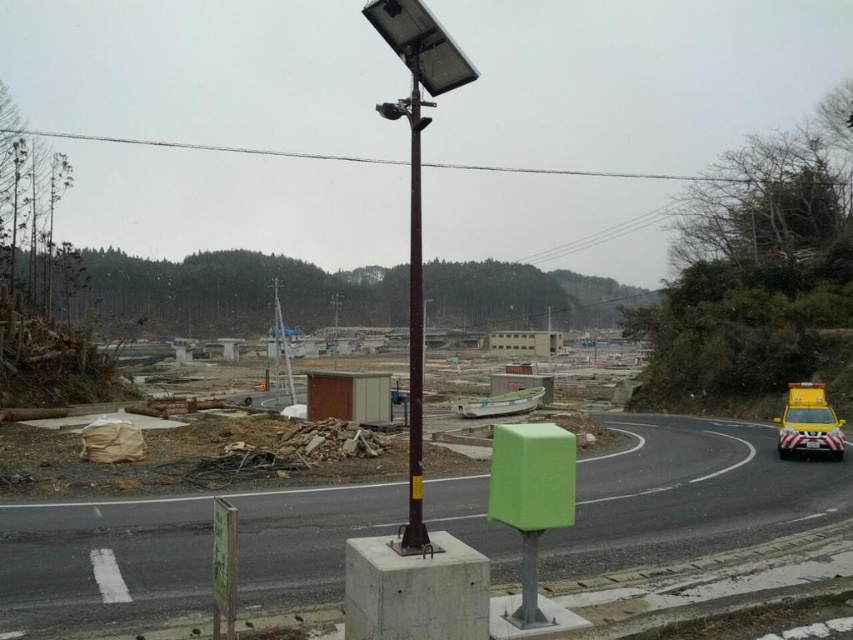
You are standing at the point marked by the coordinates point (689, 493) in the image. What object are you standing on?

You are standing on the green plastic box at center.